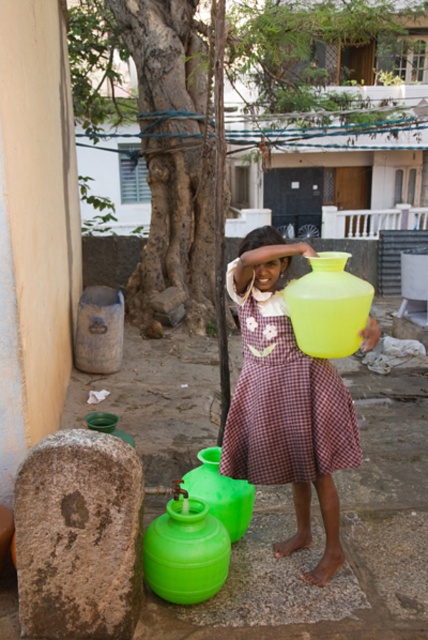
Question: Which of the following is the closest to the observer?

Choices:
 (A) brown checkered dress at center
 (B) matte brown hair at center

Answer: (B)

Question: Is brown checkered dress at center further to camera compared to matte brown hair at center?

Choices:
 (A) no
 (B) yes

Answer: (B)

Question: Which point is farther to the camera?

Choices:
 (A) matte brown hair at center
 (B) brown checkered dress at center

Answer: (B)

Question: Is brown checkered dress at center to the left of matte brown hair at center from the viewer's perspective?

Choices:
 (A) yes
 (B) no

Answer: (B)

Question: In this image, where is brown checkered dress at center located relative to matte brown hair at center?

Choices:
 (A) left
 (B) right

Answer: (B)